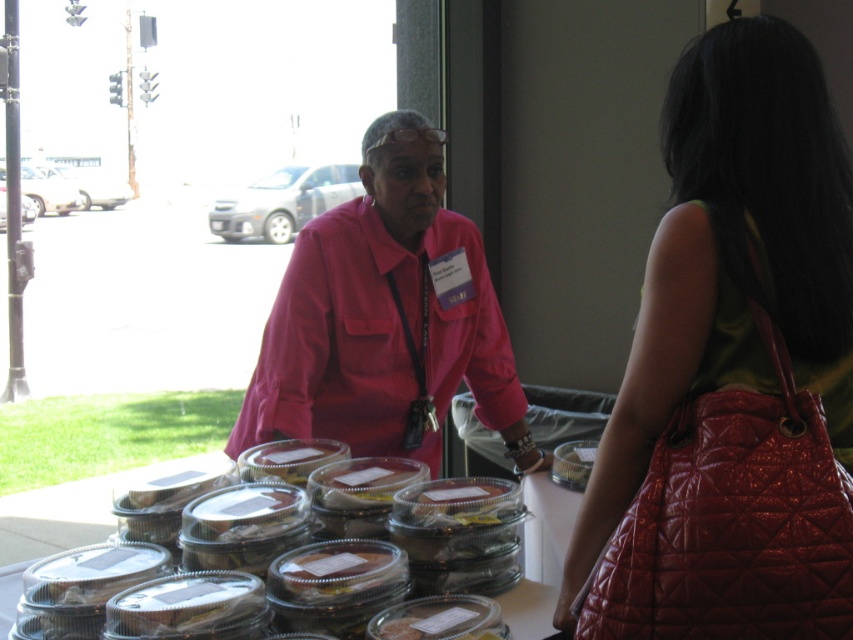
Between point (804, 552) and point (354, 330), which one is positioned behind?

Point (354, 330)

Does shiny red purse at center lie in front of pink fabric shirt at center?

That is True.

What do you see at coordinates (732, 371) in the screenshot?
I see `shiny red purse at center` at bounding box center [732, 371].

What are the coordinates of `shiny red purse at center` in the screenshot? It's located at (732, 371).